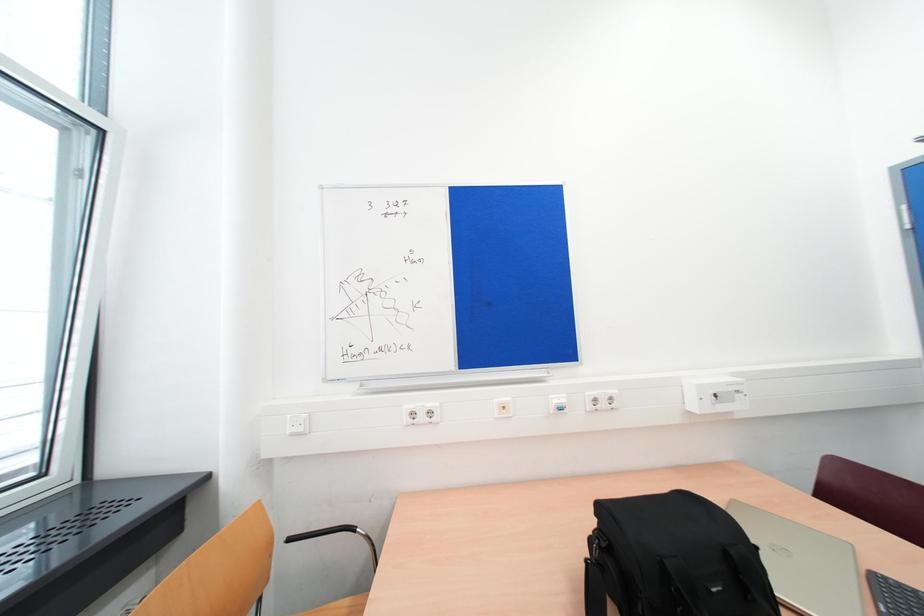
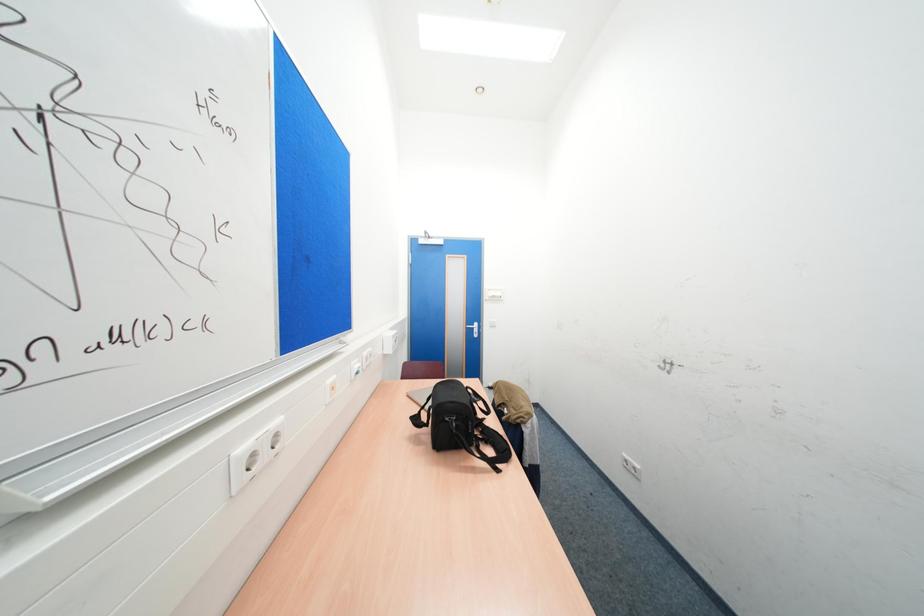
Question: Based on the continuous images, in which direction is the camera rotating? Reply with the corresponding letter.

Choices:
 (A) Left
 (B) Right
 (C) Up
 (D) Down

Answer: (B)